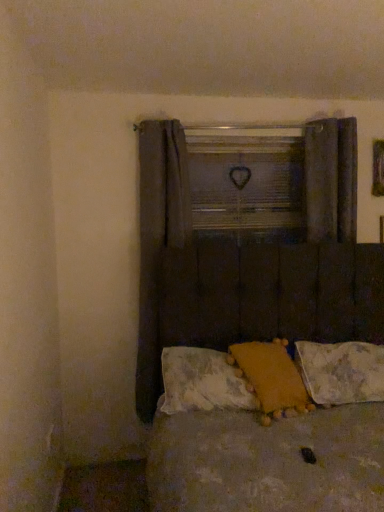
Describe the element at coordinates (247, 182) in the screenshot. I see `wooden heart at center` at that location.

The width and height of the screenshot is (384, 512). In order to click on brown tufted headboard at center in this screenshot , I will do `click(272, 293)`.

What is the approximate width of fluffy yellow pillow at center, arranged as the second pillow when viewed from the right?

fluffy yellow pillow at center, arranged as the second pillow when viewed from the right, is 15.49 inches in width.

Measure the distance between point (x=266, y=380) and camera.

Point (x=266, y=380) is 6.77 feet away from camera.

Describe the element at coordinates (341, 372) in the screenshot. The image size is (384, 512). I see `fluffy white pillow at lower right, which is counted as the first pillow, starting from the right` at that location.

Describe the element at coordinates (331, 179) in the screenshot. I see `dark fabric curtain at right, the first curtain viewed from the right` at that location.

You are a GUI agent. You are given a task and a screenshot of the screen. Output one action in this format:
    pyautogui.click(x=<x>, y=<y>)
    Task: Click on the fluffy yellow pillow at center, which ranks as the first pillow in left-to-right order
    The width and height of the screenshot is (384, 512).
    Given the screenshot: What is the action you would take?
    pyautogui.click(x=202, y=382)

At what (x,y) coordinates should I click in order to perform the action: click on wooden heart at center. Please return your answer as a coordinate pair (x, y). This screenshot has height=512, width=384. Looking at the image, I should click on (247, 182).

Does dark fabric curtain at left, which is the second curtain from right to left, have a lesser height compared to brown tufted headboard at center?

No, dark fabric curtain at left, which is the second curtain from right to left, is not shorter than brown tufted headboard at center.

Considering the points (185, 159) and (198, 500), which point is behind, point (185, 159) or point (198, 500)?

The point (185, 159) is behind.

Can you tell me how much dark fabric curtain at left, the 1th curtain from the left, and brown tufted headboard at center differ in facing direction?

2.26 degrees separate the facing orientations of dark fabric curtain at left, the 1th curtain from the left, and brown tufted headboard at center.

From a real-world perspective, who is located lower, dark fabric curtain at left, which is the second curtain from right to left, or brown tufted headboard at center?

brown tufted headboard at center.

Is fluffy yellow pillow at center, placed as the 3th pillow when sorted from right to left, positioned with its back to fluffy white pillow at lower right, which is counted as the first pillow, starting from the right?

fluffy yellow pillow at center, placed as the 3th pillow when sorted from right to left, does not have its back to fluffy white pillow at lower right, which is counted as the first pillow, starting from the right.

In terms of height, does fluffy yellow pillow at center, which ranks as the first pillow in left-to-right order, look taller or shorter compared to fluffy white pillow at lower right, which is counted as the first pillow, starting from the right?

In the image, fluffy yellow pillow at center, which ranks as the first pillow in left-to-right order, appears to be shorter than fluffy white pillow at lower right, which is counted as the first pillow, starting from the right.

How different are the orientations of fluffy yellow pillow at center, which ranks as the first pillow in left-to-right order, and fluffy white pillow at lower right, which is counted as the first pillow, starting from the right, in degrees?

They differ by 0.601 degrees in their facing directions.

Is point (217, 381) closer or farther from the camera than point (325, 387)?

Point (217, 381) is closer to the camera than point (325, 387).

From the image's perspective, which pillow is the 1st one below the fluffy yellow pillow at center, arranged as the second pillow when viewed from the left? Please provide its 2D coordinates.

[(202, 382)]

Considering the positions of points (269, 361) and (221, 405), is point (269, 361) closer to camera compared to point (221, 405)?

No.

From the image's perspective, is fluffy yellow pillow at center, arranged as the second pillow when viewed from the left, on top of fluffy yellow pillow at center, placed as the 3th pillow when sorted from right to left?

Yes.

Can you tell me how much fluffy yellow pillow at center, arranged as the second pillow when viewed from the right, and fluffy yellow pillow at center, which ranks as the first pillow in left-to-right order, differ in facing direction?

The angular difference between fluffy yellow pillow at center, arranged as the second pillow when viewed from the right, and fluffy yellow pillow at center, which ranks as the first pillow in left-to-right order, is 17.5 degrees.

Considering the positions of points (348, 201) and (335, 391), is point (348, 201) closer to camera compared to point (335, 391)?

That is False.

Considering the sizes of objects dark fabric curtain at right, the first curtain viewed from the right, and fluffy white pillow at lower right, which appears as the 3th pillow when viewed from the left, in the image provided, who is wider, dark fabric curtain at right, the first curtain viewed from the right, or fluffy white pillow at lower right, which appears as the 3th pillow when viewed from the left,?

fluffy white pillow at lower right, which appears as the 3th pillow when viewed from the left, is wider.

From the image's perspective, is dark fabric curtain at right, the first curtain viewed from the right, located above or below fluffy white pillow at lower right, which appears as the 3th pillow when viewed from the left?

Based on their image positions, dark fabric curtain at right, the first curtain viewed from the right, is located above fluffy white pillow at lower right, which appears as the 3th pillow when viewed from the left.

Can you confirm if brown tufted headboard at center is wider than fluffy yellow pillow at center, which ranks as the first pillow in left-to-right order?

Yes.

Does brown tufted headboard at center turn towards fluffy yellow pillow at center, placed as the 3th pillow when sorted from right to left?

No, brown tufted headboard at center is not aimed at fluffy yellow pillow at center, placed as the 3th pillow when sorted from right to left.

Based on the photo, can you confirm if brown tufted headboard at center is positioned to the right of fluffy yellow pillow at center, which ranks as the first pillow in left-to-right order?

Yes.

From a real-world perspective, which is physically below, brown tufted headboard at center or fluffy yellow pillow at center, placed as the 3th pillow when sorted from right to left?

In real-world perspective, brown tufted headboard at center is lower.

Is dark fabric curtain at right, the first curtain viewed from the right, spatially inside dark fabric curtain at left, which is the second curtain from right to left, or outside of it?

dark fabric curtain at right, the first curtain viewed from the right, is outside dark fabric curtain at left, which is the second curtain from right to left.

Is dark fabric curtain at right, the first curtain viewed from the right, facing away from dark fabric curtain at left, the 1th curtain from the left?

No.

Which object is thinner, dark fabric curtain at right, the first curtain viewed from the right, or dark fabric curtain at left, which is the second curtain from right to left?

Thinner between the two is dark fabric curtain at right, the first curtain viewed from the right.

How distant is dark fabric curtain at right, the second curtain positioned from the left, from dark fabric curtain at left, which is the second curtain from right to left?

dark fabric curtain at right, the second curtain positioned from the left, is 3.31 feet away from dark fabric curtain at left, which is the second curtain from right to left.

From a real-world perspective, which is physically below, wooden heart at center or fluffy yellow pillow at center, arranged as the second pillow when viewed from the left?

fluffy yellow pillow at center, arranged as the second pillow when viewed from the left, is physically lower.

Does point (238, 153) come in front of point (263, 362)?

No, (238, 153) is behind (263, 362).

How many degrees apart are the facing directions of wooden heart at center and fluffy yellow pillow at center, arranged as the second pillow when viewed from the left?

wooden heart at center and fluffy yellow pillow at center, arranged as the second pillow when viewed from the left, are facing 16.5 degrees away from each other.

Considering the relative sizes of wooden heart at center and fluffy yellow pillow at center, arranged as the second pillow when viewed from the right, in the image provided, is wooden heart at center shorter than fluffy yellow pillow at center, arranged as the second pillow when viewed from the right,?

No.

In the image, there is a dark fabric curtain at left, the 1th curtain from the left. In order to click on bed below it (from a real-world perspective) in this screenshot , I will do `click(272, 293)`.

Where is `pillow behind the fluffy yellow pillow at center, which ranks as the first pillow in left-to-right order`? The image size is (384, 512). pillow behind the fluffy yellow pillow at center, which ranks as the first pillow in left-to-right order is located at coordinates (341, 372).

From the picture: Based on their spatial positions, is dark fabric curtain at left, the 1th curtain from the left, or brown tufted headboard at center further from fluffy yellow pillow at center, arranged as the second pillow when viewed from the right?

dark fabric curtain at left, the 1th curtain from the left, lies further to fluffy yellow pillow at center, arranged as the second pillow when viewed from the right, than the other object.

Based on their spatial positions, is wooden heart at center or dark fabric curtain at right, the first curtain viewed from the right, closer to dark fabric curtain at left, which is the second curtain from right to left?

wooden heart at center lies closer to dark fabric curtain at left, which is the second curtain from right to left, than the other object.

From the image, which object appears to be farther from fluffy yellow pillow at center, placed as the 3th pillow when sorted from right to left, fluffy yellow pillow at center, arranged as the second pillow when viewed from the right, or dark fabric curtain at right, the first curtain viewed from the right?

Among the two, dark fabric curtain at right, the first curtain viewed from the right, is located further to fluffy yellow pillow at center, placed as the 3th pillow when sorted from right to left.

Estimate the real-world distances between objects in this image. Which object is further from brown tufted headboard at center, fluffy white pillow at lower right, which is counted as the first pillow, starting from the right, or fluffy yellow pillow at center, arranged as the second pillow when viewed from the left?

The object further to brown tufted headboard at center is fluffy yellow pillow at center, arranged as the second pillow when viewed from the left.

Which object lies further to the anchor point dark fabric curtain at left, which is the second curtain from right to left, dark fabric curtain at right, the first curtain viewed from the right, or brown tufted headboard at center?

Among the two, dark fabric curtain at right, the first curtain viewed from the right, is located further to dark fabric curtain at left, which is the second curtain from right to left.

Which object lies nearer to the anchor point fluffy yellow pillow at center, arranged as the second pillow when viewed from the right, brown tufted headboard at center or dark fabric curtain at left, the 1th curtain from the left?

brown tufted headboard at center lies closer to fluffy yellow pillow at center, arranged as the second pillow when viewed from the right, than the other object.

Considering their positions, is fluffy white pillow at lower right, which is counted as the first pillow, starting from the right, positioned further to brown tufted headboard at center than wooden heart at center?

Based on the image, wooden heart at center appears to be further to brown tufted headboard at center.

From the image, which object appears to be nearer to fluffy yellow pillow at center, which ranks as the first pillow in left-to-right order, fluffy white pillow at lower right, which is counted as the first pillow, starting from the right, or dark fabric curtain at left, the 1th curtain from the left?

dark fabric curtain at left, the 1th curtain from the left.

I want to click on pillow that lies between dark fabric curtain at right, the first curtain viewed from the right, and fluffy yellow pillow at center, placed as the 3th pillow when sorted from right to left, from top to bottom, so click(x=271, y=377).

Where is `curtain between brown tufted headboard at center and dark fabric curtain at right, the second curtain positioned from the left, from front to back`? This screenshot has width=384, height=512. curtain between brown tufted headboard at center and dark fabric curtain at right, the second curtain positioned from the left, from front to back is located at coordinates (163, 255).

Image resolution: width=384 pixels, height=512 pixels. Identify the location of window between dark fabric curtain at left, the 1th curtain from the left, and dark fabric curtain at right, the first curtain viewed from the right, in the horizontal direction. (247, 182).

Where is `pillow between fluffy yellow pillow at center, which ranks as the first pillow in left-to-right order, and fluffy white pillow at lower right, which appears as the 3th pillow when viewed from the left, from left to right`? pillow between fluffy yellow pillow at center, which ranks as the first pillow in left-to-right order, and fluffy white pillow at lower right, which appears as the 3th pillow when viewed from the left, from left to right is located at coordinates (271, 377).